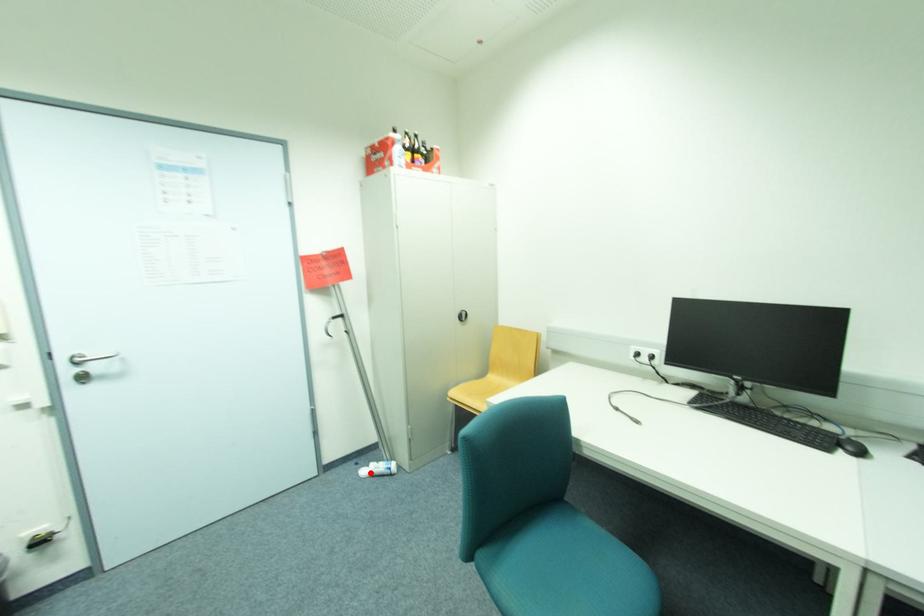
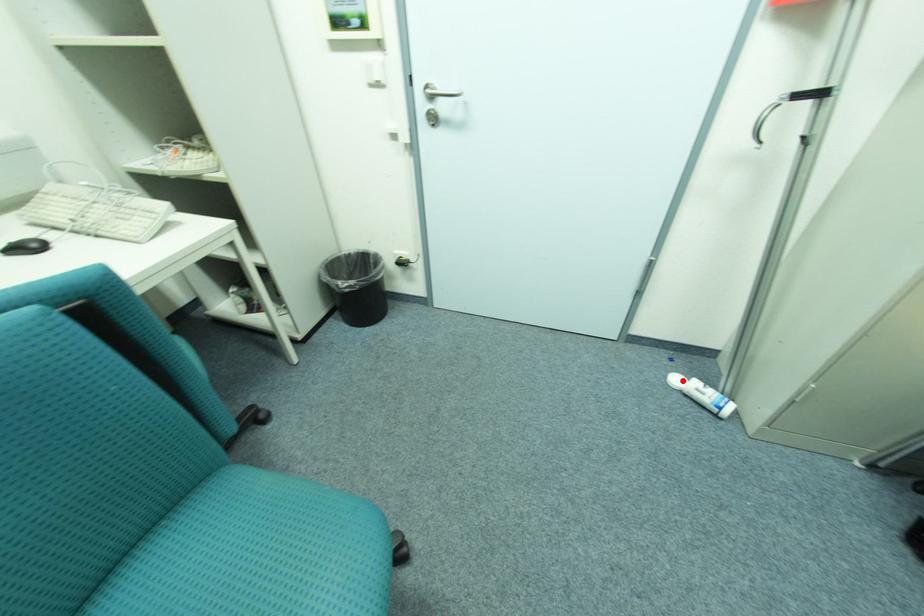
I am providing you with two images of the same scene from different viewpoints. A red point is marked on the first image and another point is marked on the second image. Is the marked point in image1 the same physical position as the marked point in image2?

Yes